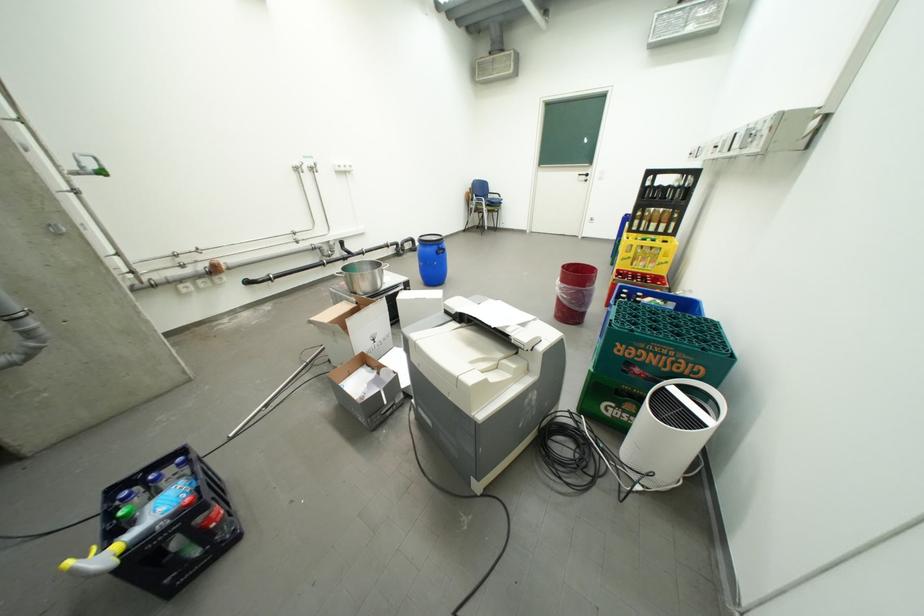
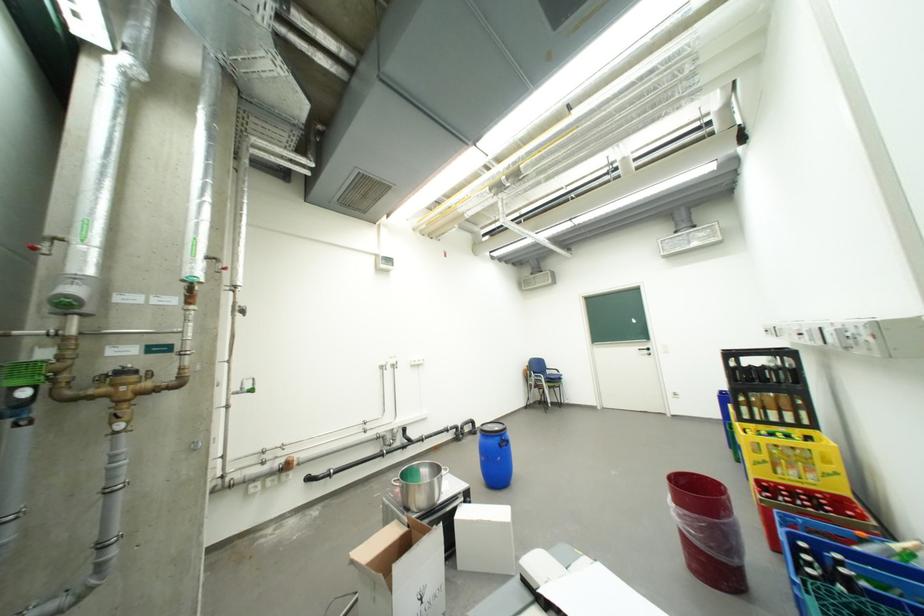
The point at (652, 270) is marked in the first image. Where is the corresponding point in the second image?

(810, 484)